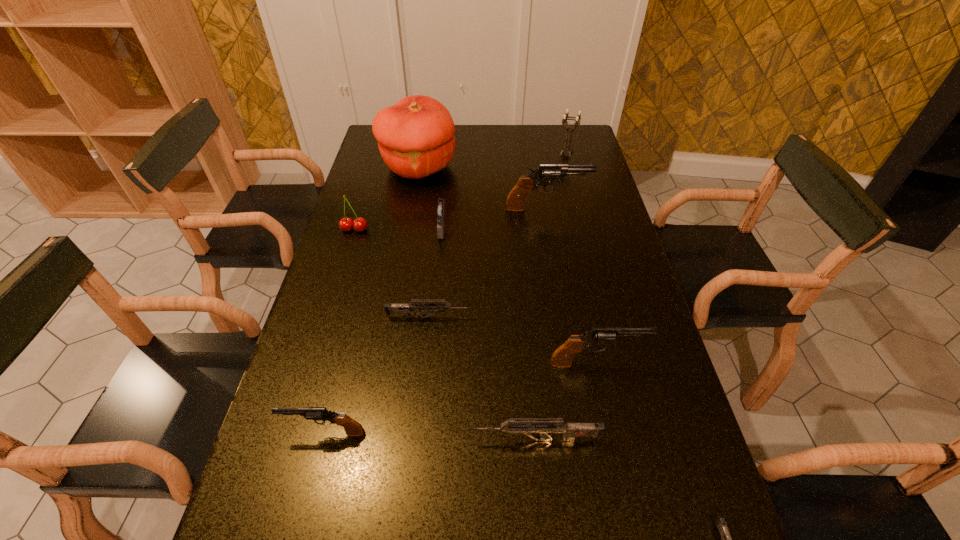
The height and width of the screenshot is (540, 960). I want to click on object that is at the far right corner, so click(564, 121).

This screenshot has width=960, height=540. I want to click on vacant space at the far edge of the desktop, so click(535, 134).

What are the coordinates of `free region at the left edge` in the screenshot? It's located at (292, 387).

Identify the location of vacant space at the right edge. (603, 400).

Locate an element on the screen. The height and width of the screenshot is (540, 960). free space at the far left corner of the desktop is located at coordinates (374, 147).

Find the location of a particular element. Image resolution: width=960 pixels, height=540 pixels. free spot at the far right corner of the desktop is located at coordinates (588, 135).

Where is `unoccupied position between the cherry and the fifth nearest gun`? The width and height of the screenshot is (960, 540). unoccupied position between the cherry and the fifth nearest gun is located at coordinates (392, 273).

At what (x,y) coordinates should I click in order to perform the action: click on free space between the second farthest grey gun and the tallest object. Please return your answer as a coordinate pair (x, y). This screenshot has height=540, width=960. Looking at the image, I should click on (477, 303).

You are a GUI agent. You are given a task and a screenshot of the screen. Output one action in this format:
    pyautogui.click(x=<x>, y=<y>)
    Task: Click on the vacant region between the igniter and the second farthest gun
    
    Given the screenshot: What is the action you would take?
    pyautogui.click(x=436, y=273)

Locate an element on the screen. free space between the fourth shortest gun and the tallest object is located at coordinates click(x=372, y=300).